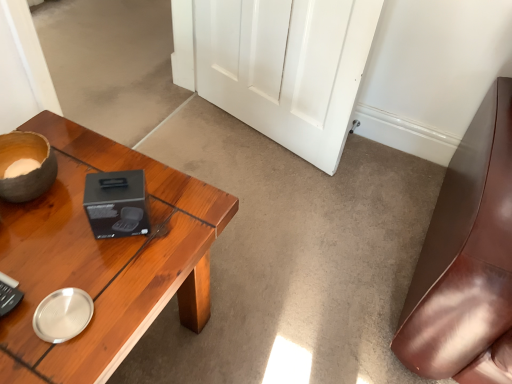
Question: From the image's perspective, is white glossy door at center positioned above or below wooden desk at left?

Choices:
 (A) above
 (B) below

Answer: (A)

Question: In terms of width, does white glossy door at center look wider or thinner when compared to wooden desk at left?

Choices:
 (A) wide
 (B) thin

Answer: (B)

Question: Considering the positions of white glossy door at center and wooden desk at left in the image, is white glossy door at center taller or shorter than wooden desk at left?

Choices:
 (A) short
 (B) tall

Answer: (B)

Question: From a real-world perspective, is wooden desk at left physically located above or below white glossy door at center?

Choices:
 (A) above
 (B) below

Answer: (B)

Question: In the image, is wooden desk at left positioned in front of or behind white glossy door at center?

Choices:
 (A) front
 (B) behind

Answer: (A)

Question: Is point (216, 210) closer or farther from the camera than point (202, 82)?

Choices:
 (A) farther
 (B) closer

Answer: (B)

Question: From the image's perspective, is wooden desk at left located above or below white glossy door at center?

Choices:
 (A) above
 (B) below

Answer: (B)